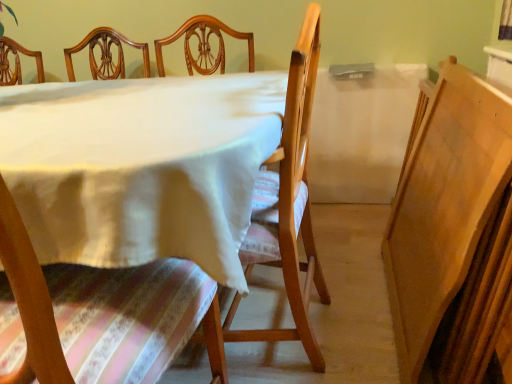
Question: From a real-world perspective, is wooden chair at center, the 1th chair from the left, on top of wooden chair at center, acting as the first chair starting from the right?

Choices:
 (A) no
 (B) yes

Answer: (B)

Question: Considering the relative sizes of wooden chair at center, the 1th chair from the left, and wooden chair at center, arranged as the 2th chair when viewed from the left, in the image provided, is wooden chair at center, the 1th chair from the left, bigger than wooden chair at center, arranged as the 2th chair when viewed from the left,?

Choices:
 (A) yes
 (B) no

Answer: (A)

Question: From a real-world perspective, is wooden chair at center, the 1th chair from the left, located beneath wooden chair at center, arranged as the 2th chair when viewed from the left?

Choices:
 (A) no
 (B) yes

Answer: (A)

Question: Can you see wooden chair at center, positioned as the second chair in right-to-left order, touching wooden chair at center, acting as the first chair starting from the right?

Choices:
 (A) no
 (B) yes

Answer: (A)

Question: Is wooden chair at center, the 1th chair from the left, facing away from wooden chair at center, arranged as the 2th chair when viewed from the left?

Choices:
 (A) yes
 (B) no

Answer: (B)

Question: Can you confirm if wooden chair at center, the 1th chair from the left, is thinner than wooden chair at center, arranged as the 2th chair when viewed from the left?

Choices:
 (A) yes
 (B) no

Answer: (B)

Question: Is white cloth at center inside wooden chair at center, acting as the first chair starting from the right?

Choices:
 (A) yes
 (B) no

Answer: (B)

Question: Is wooden chair at center, arranged as the 2th chair when viewed from the left, at the right side of white cloth at center?

Choices:
 (A) no
 (B) yes

Answer: (B)

Question: From the image's perspective, is wooden chair at center, arranged as the 2th chair when viewed from the left, under white cloth at center?

Choices:
 (A) no
 (B) yes

Answer: (A)

Question: From the image's perspective, is wooden chair at center, acting as the first chair starting from the right, over white cloth at center?

Choices:
 (A) no
 (B) yes

Answer: (B)

Question: Considering the relative sizes of wooden chair at center, arranged as the 2th chair when viewed from the left, and white cloth at center in the image provided, is wooden chair at center, arranged as the 2th chair when viewed from the left, bigger than white cloth at center?

Choices:
 (A) yes
 (B) no

Answer: (B)

Question: Is wooden chair at center, acting as the first chair starting from the right, positioned beyond the bounds of white cloth at center?

Choices:
 (A) no
 (B) yes

Answer: (A)

Question: Would you say white cloth at center is part of wooden chair at center, positioned as the second chair in right-to-left order,'s contents?

Choices:
 (A) no
 (B) yes

Answer: (A)